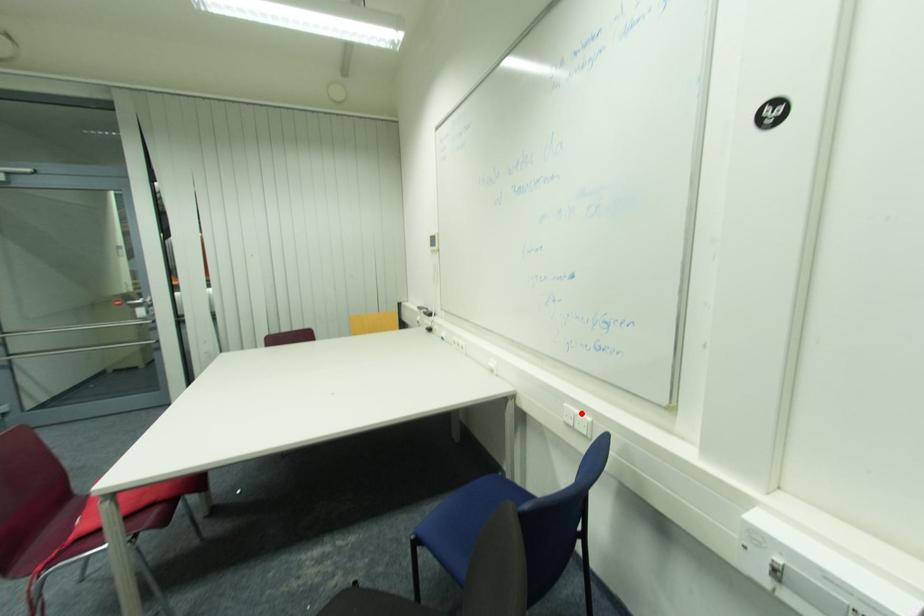
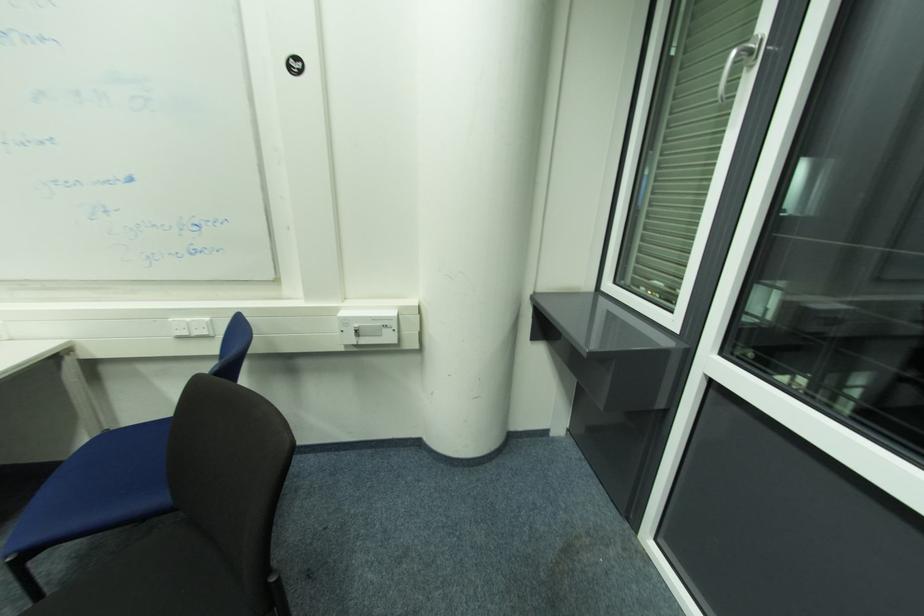
Locate, in the second image, the point that corresponds to the highlighted location in the first image.

(191, 320)